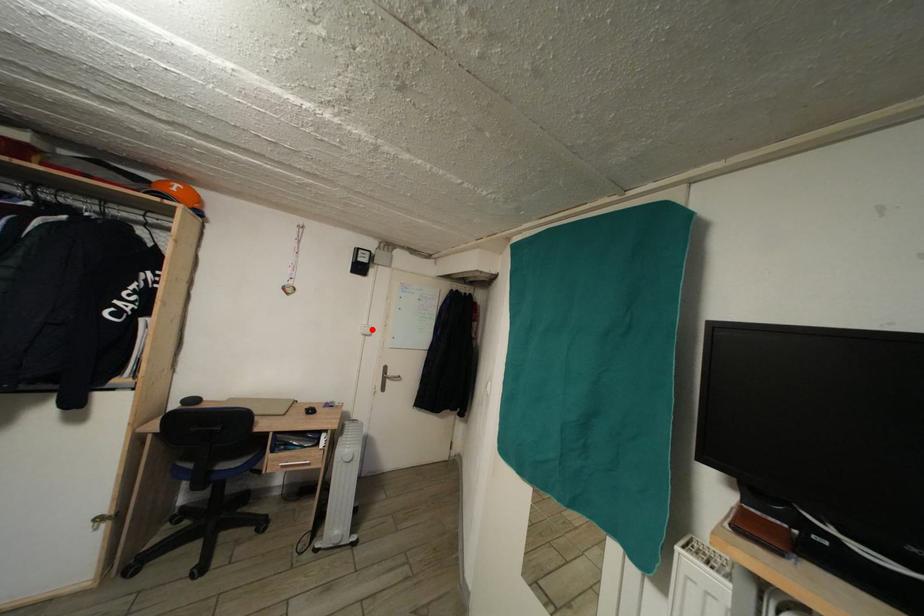
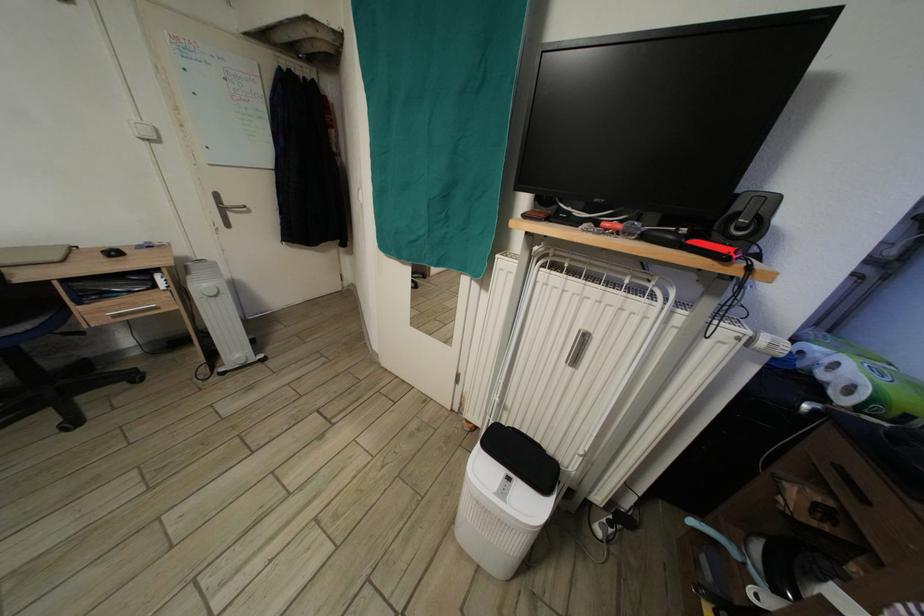
Question: I am providing you with two images of the same scene from different viewpoints. A red point is marked on the first image. Is the red point's position out of view in image 2?

Choices:
 (A) Yes
 (B) No

Answer: (B)